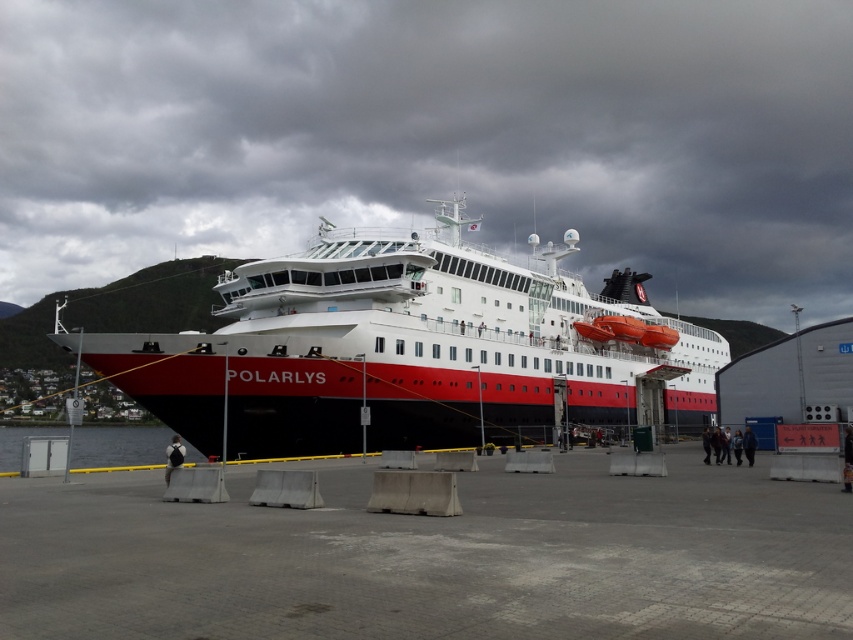
You are standing on the pier and want to locate the POLARLYS cruise ship. Which object at point coordinates [410,349] can help you identify its exact location?

The point coordinates [410,349] corresponds to the red matte ship at center, which is the POLARLYS cruise ship, so this point will help you identify its exact location.

You are standing on the pier next to the red matte ship at center. You want to see the clear water at lower left. Which direction should you look relative to the ship?

The clear water at lower left is behind the red matte ship at center, so you should look behind the ship to see it.

You are standing on the pier looking at the POLARLYS cruise ship. There are two points marked on the ship. Which point is closer to you, point (149, 342) or point (138, 436)?

Point (149, 342) is closer to the viewer than point (138, 436).